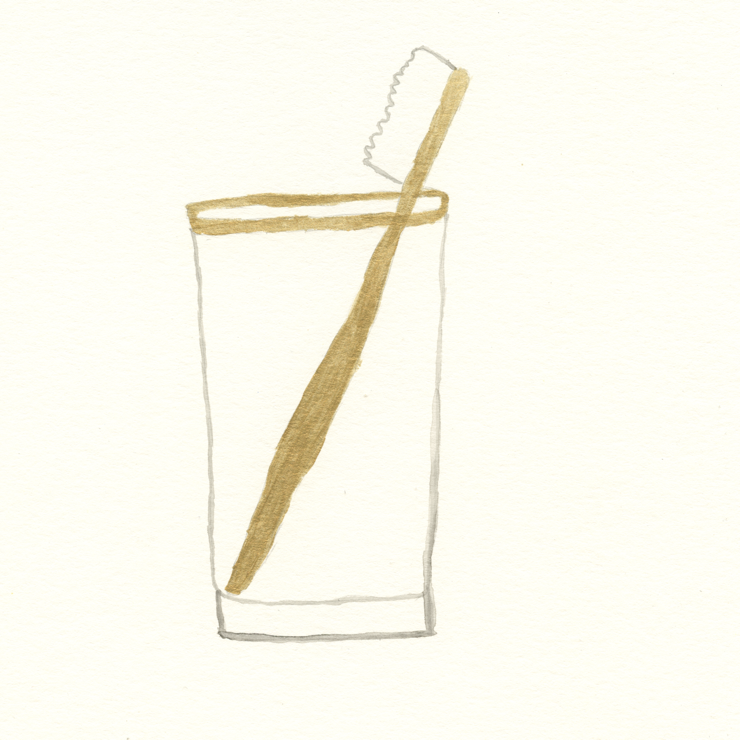
The width and height of the screenshot is (740, 740). What are the coordinates of `bottom rim of cup` in the screenshot? It's located at (349, 605).